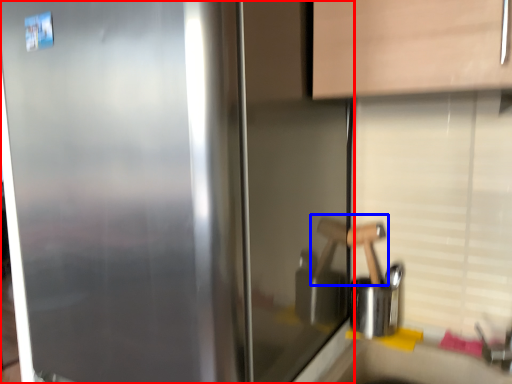
Question: Which object appears farthest to the camera in this image, refrigerator (highlighted by a red box) or door handle (highlighted by a blue box)?

Choices:
 (A) refrigerator
 (B) door handle

Answer: (B)